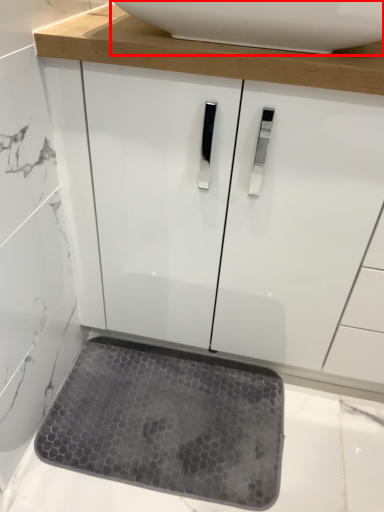
Question: Observing the image, what is the correct spatial positioning of sink (annotated by the red box) in reference to mat?

Choices:
 (A) left
 (B) right

Answer: (B)